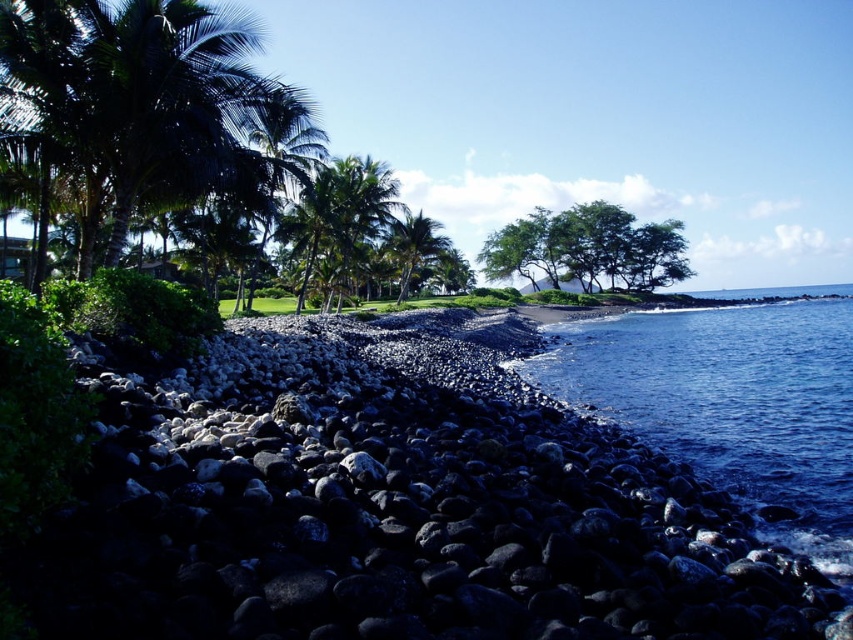
Question: Does dark blue water at lower right appear over green leafy trees at center?

Choices:
 (A) no
 (B) yes

Answer: (A)

Question: Which point is closer to the camera?

Choices:
 (A) (659, 284)
 (B) (628, 509)

Answer: (B)

Question: Which of the following is the closest to the observer?

Choices:
 (A) green leafy trees at center
 (B) black volcanic rocks at lower left
 (C) green leafy palm tree at upper left
 (D) dark blue water at lower right

Answer: (B)

Question: Does green leafy trees at center lie behind green leafy palm tree at center?

Choices:
 (A) no
 (B) yes

Answer: (B)

Question: Among these objects, which one is farthest from the camera?

Choices:
 (A) black volcanic rocks at lower left
 (B) green leafy palm tree at upper left
 (C) green leafy trees at center
 (D) green leafy palm tree at center

Answer: (C)

Question: In this image, where is dark blue water at lower right located relative to green leafy palm tree at center?

Choices:
 (A) below
 (B) above

Answer: (A)